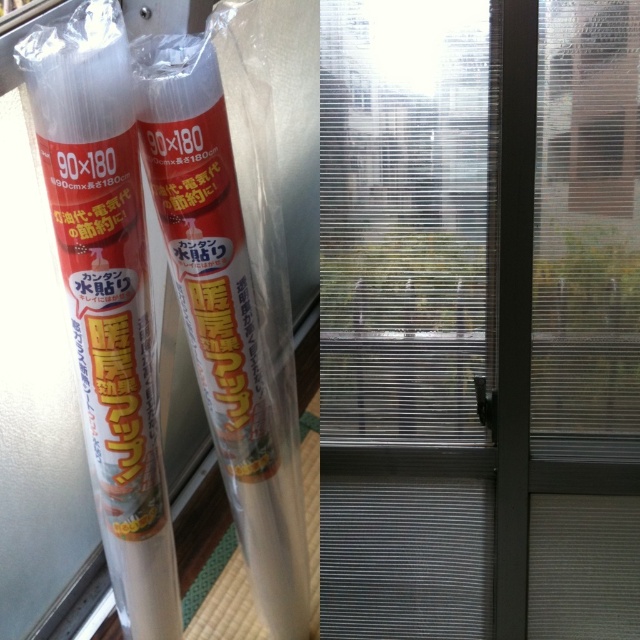
What do you see at coordinates (230, 294) in the screenshot?
I see `transparent plastic tube at center` at bounding box center [230, 294].

Does point (241, 397) lie in front of point (36, 77)?

No.

Between point (150, 109) and point (81, 269), which one is positioned in front?

Point (81, 269) is more forward.

Locate an element on the screen. This screenshot has height=640, width=640. transparent plastic tube at center is located at coordinates (230, 294).

What do you see at coordinates (477, 317) in the screenshot? The height and width of the screenshot is (640, 640). I see `transparent frosted glass door at center` at bounding box center [477, 317].

Is transparent frosted glass door at center closer to camera compared to transparent plastic tube at center?

No, transparent frosted glass door at center is behind transparent plastic tube at center.

Is point (362, 148) less distant than point (230, 266)?

No.

The height and width of the screenshot is (640, 640). I want to click on transparent frosted glass door at center, so click(477, 317).

Is transparent frosted glass door at center wider than transparent plastic tube at left?

Indeed, transparent frosted glass door at center has a greater width compared to transparent plastic tube at left.

Does transparent frosted glass door at center appear over transparent plastic tube at left?

Correct, transparent frosted glass door at center is located above transparent plastic tube at left.

Does point (488, 253) lie behind point (99, 284)?

Yes, point (488, 253) is farther from viewer.

The height and width of the screenshot is (640, 640). In order to click on transparent frosted glass door at center in this screenshot , I will do `click(477, 317)`.